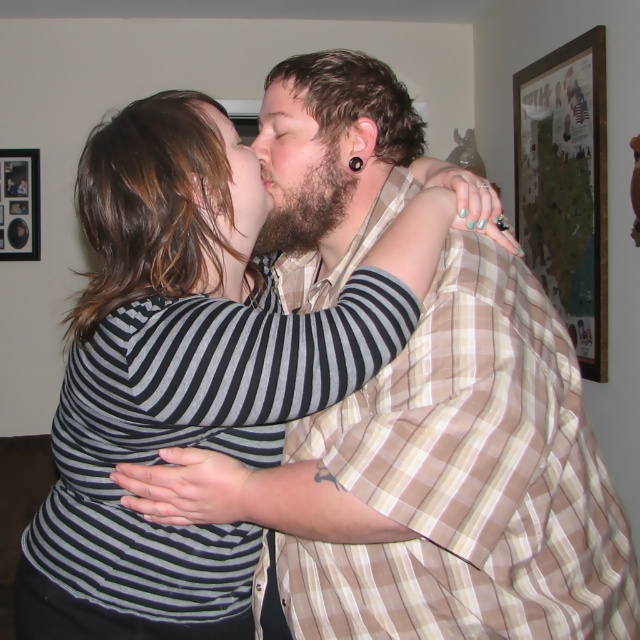
Question: Which point is closer to the camera?

Choices:
 (A) wooden picture frame at upper left
 (B) bearded man at center

Answer: (B)

Question: Is the position of bearded man at center less distant than that of beige plaid shirt at center?

Choices:
 (A) no
 (B) yes

Answer: (A)

Question: Which point is closer to the camera?

Choices:
 (A) beige plaid shirt at center
 (B) wooden framed map at upper right
 (C) wooden picture frame at upper left

Answer: (A)

Question: Can you confirm if striped fabric shirt at center is bigger than beige plaid shirt at center?

Choices:
 (A) yes
 (B) no

Answer: (A)

Question: Which of the following is the farthest from the observer?

Choices:
 (A) striped fabric shirt at center
 (B) beige plaid shirt at center
 (C) bearded man at center
 (D) wooden picture frame at upper left

Answer: (D)

Question: Can you confirm if wooden framed map at upper right is positioned to the left of wooden picture frame at upper left?

Choices:
 (A) yes
 (B) no

Answer: (B)